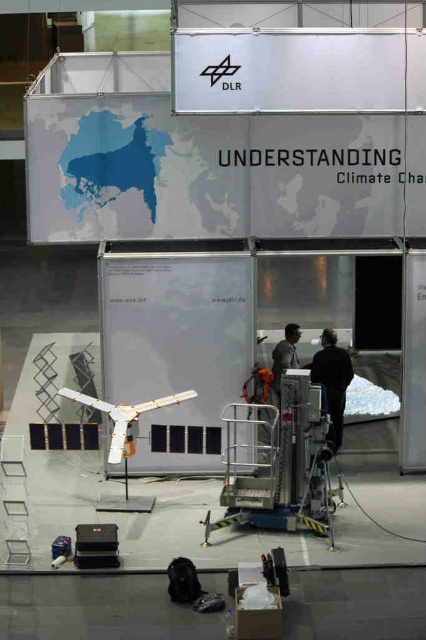
Question: Is metallic silver platform at center wider than black matte jacket at center?

Choices:
 (A) no
 (B) yes

Answer: (B)

Question: Is metallic silver platform at center wider than dark gray fabric jacket at center?

Choices:
 (A) yes
 (B) no

Answer: (A)

Question: Which object is positioned closest to the dark gray fabric jacket at center?

Choices:
 (A) black matte jacket at center
 (B) white plastic satellite at center
 (C) metallic silver platform at center

Answer: (A)

Question: Which point appears farthest from the camera in this image?

Choices:
 (A) (331, 339)
 (B) (94, 404)

Answer: (A)

Question: Which object is closer to the camera taking this photo?

Choices:
 (A) dark gray fabric jacket at center
 (B) metallic silver platform at center
 (C) black matte jacket at center

Answer: (B)

Question: Is black matte jacket at center above white plastic satellite at center?

Choices:
 (A) yes
 (B) no

Answer: (A)